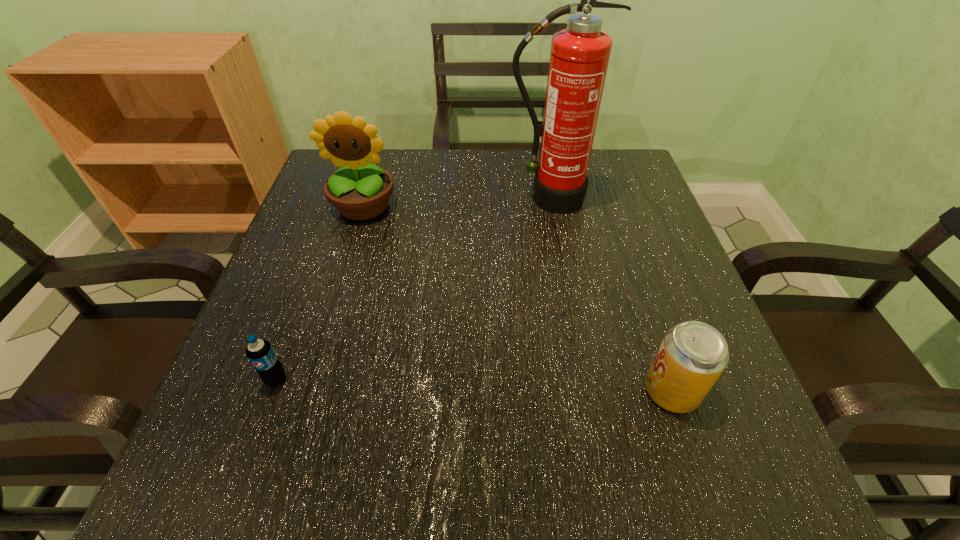
Find the location of `fire extinguisher situated at the far edge`. fire extinguisher situated at the far edge is located at coordinates (579, 57).

Find the location of `sunflower that is at the far edge`. sunflower that is at the far edge is located at coordinates (362, 192).

Where is `sunflower that is at the left edge`? sunflower that is at the left edge is located at coordinates (362, 192).

Locate an element on the screen. The height and width of the screenshot is (540, 960). soda bottle that is at the left edge is located at coordinates (260, 353).

The width and height of the screenshot is (960, 540). Identify the location of fire extinguisher at the right edge. (579, 57).

Find the location of a particular element. The image size is (960, 540). pop (soda) located at the right edge is located at coordinates (692, 356).

At what (x,y) coordinates should I click in order to perform the action: click on object positioned at the far left corner. Please return your answer as a coordinate pair (x, y). This screenshot has height=540, width=960. Looking at the image, I should click on (362, 192).

Identify the location of object at the far right corner. This screenshot has height=540, width=960. (579, 57).

Identify the location of free space at the far edge. This screenshot has width=960, height=540. (471, 165).

Where is `free space at the near edge of the desktop`? The width and height of the screenshot is (960, 540). free space at the near edge of the desktop is located at coordinates (571, 490).